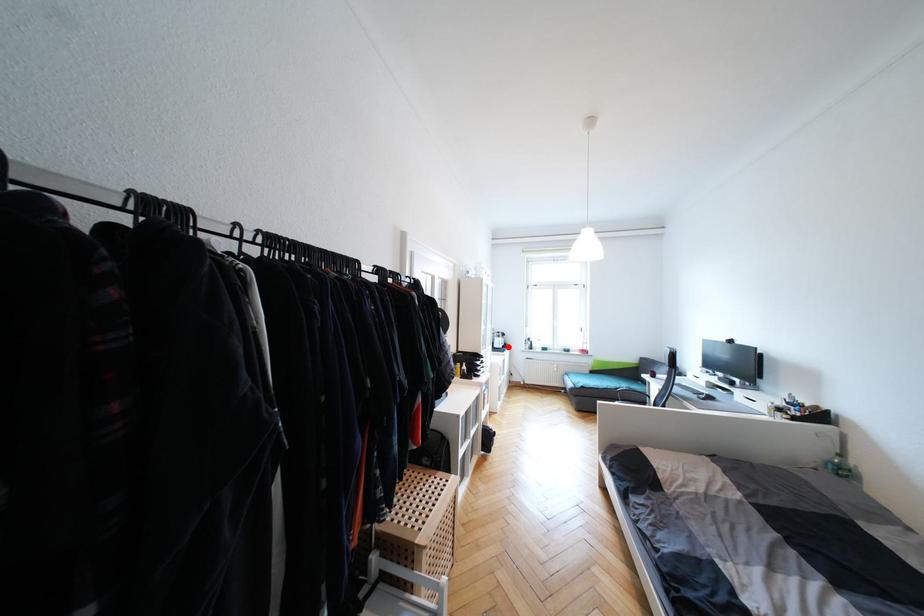
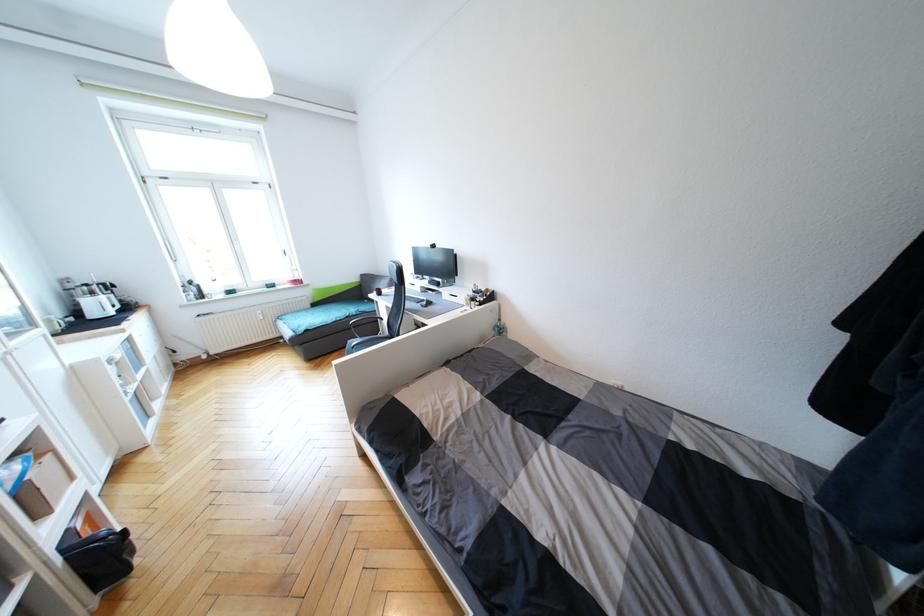
Where in the second image is the point corresponding to the highlighted location from the first image?

(130, 309)